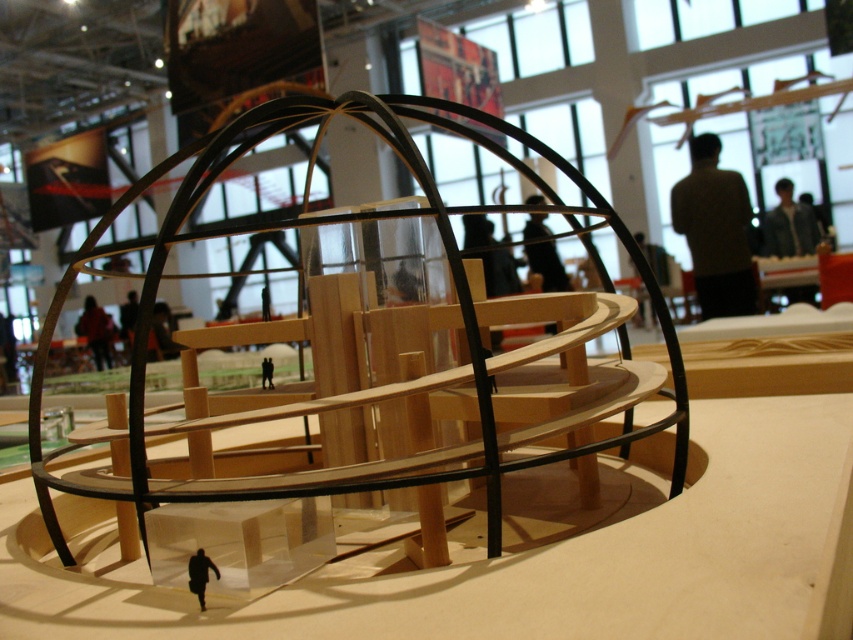
Question: Is light brown sweater at upper right above wooden figure at center?

Choices:
 (A) yes
 (B) no

Answer: (A)

Question: Estimate the real-world distances between objects in this image. Which object is closer to the light brown sweater at upper right?

Choices:
 (A) dark brown leather jacket at center
 (B) wooden figure at center

Answer: (A)

Question: Which point is closer to the camera taking this photo?

Choices:
 (A) (268, 385)
 (B) (715, 216)
 (C) (192, 588)
 (D) (91, 321)

Answer: (C)

Question: Based on their relative distances, which object is farther from the black matte figure at lower center?

Choices:
 (A) light brown sweater at upper right
 (B) denim jacket at upper right
 (C) dark brown leather jacket at center

Answer: (B)

Question: Does dark brown leather jacket at center appear on the left side of wooden figure at center?

Choices:
 (A) yes
 (B) no

Answer: (A)

Question: Does dark brown leather jacket at center appear over black matte figure at lower center?

Choices:
 (A) no
 (B) yes

Answer: (B)